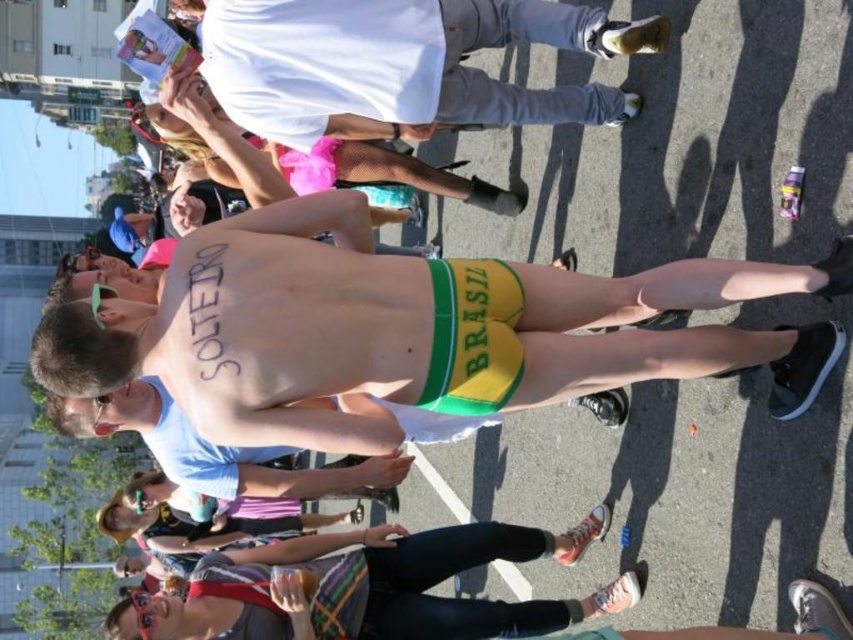
Can you confirm if yellow-green fabric shorts at center is shorter than matte blue shirt at center?

In fact, yellow-green fabric shorts at center may be taller than matte blue shirt at center.

Is yellow-green fabric shorts at center smaller than matte blue shirt at center?

Yes.

What do you see at coordinates (407, 336) in the screenshot? I see `yellow-green fabric shorts at center` at bounding box center [407, 336].

Where is `yellow-green fabric shorts at center`? This screenshot has height=640, width=853. yellow-green fabric shorts at center is located at coordinates (x=407, y=336).

Who is shorter, white matte shirt at upper center or matte blue shirt at center?

With less height is white matte shirt at upper center.

Between point (402, 93) and point (106, 413), which one is positioned in front?

Point (106, 413) is in front.

Locate an element on the screen. Image resolution: width=853 pixels, height=640 pixels. white matte shirt at upper center is located at coordinates pos(402,65).

Does yellow-green fabric shorts at center lie in front of white matte shirt at upper center?

Yes, it is in front of white matte shirt at upper center.

Who is more distant from viewer, [283,349] or [206,74]?

Point [206,74]

Where is `yellow-green fabric shorts at center`? The width and height of the screenshot is (853, 640). yellow-green fabric shorts at center is located at coordinates (407, 336).